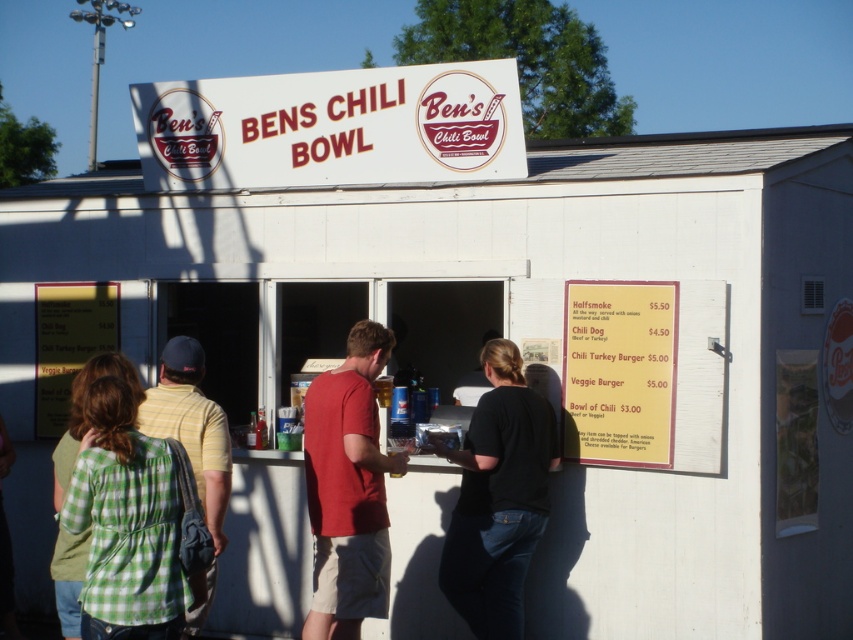
Does green plaid shirt at left appear on the left side of red cotton t-shirt at center?

Yes, green plaid shirt at left is to the left of red cotton t-shirt at center.

Who is shorter, green plaid shirt at left or red cotton t-shirt at center?

green plaid shirt at left

Is point (120, 596) in front of point (308, 515)?

Yes, point (120, 596) is closer to viewer.

The image size is (853, 640). I want to click on green plaid shirt at left, so click(126, 524).

Can you confirm if green plaid shirt at left is bigger than black cotton shirt at center?

Incorrect, green plaid shirt at left is not larger than black cotton shirt at center.

Does green plaid shirt at left appear on the left side of black cotton shirt at center?

Correct, you'll find green plaid shirt at left to the left of black cotton shirt at center.

Who is more forward, (99, 611) or (506, 420)?

Point (99, 611)

This screenshot has height=640, width=853. In order to click on green plaid shirt at left in this screenshot , I will do pos(126,524).

Between point (473, 545) and point (370, 324), which one is positioned behind?

Positioned behind is point (473, 545).

Is point (514, 589) farther from viewer compared to point (315, 572)?

Yes, point (514, 589) is behind point (315, 572).

Which is behind, point (459, 605) or point (360, 516)?

The point (459, 605) is more distant.

The height and width of the screenshot is (640, 853). Find the location of `black cotton shirt at center`. black cotton shirt at center is located at coordinates (498, 497).